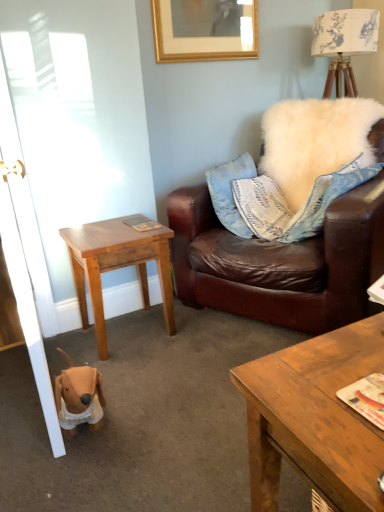
Question: Is light brown wooden table at lower left wider or thinner than wooden coffee table at lower right?

Choices:
 (A) wide
 (B) thin

Answer: (B)

Question: Is point (152, 254) positioned closer to the camera than point (281, 414)?

Choices:
 (A) closer
 (B) farther

Answer: (B)

Question: Which of these objects is positioned closest to the white glossy door at left?

Choices:
 (A) light brown wooden table at lower left
 (B) white fluffy pillow at upper right
 (C) gold wooden picture frame at upper center
 (D) wooden coffee table at lower right

Answer: (A)

Question: Which object is the farthest from the white glossy door at left?

Choices:
 (A) wooden coffee table at lower right
 (B) gold wooden picture frame at upper center
 (C) light brown wooden table at lower left
 (D) white fluffy pillow at upper right

Answer: (A)